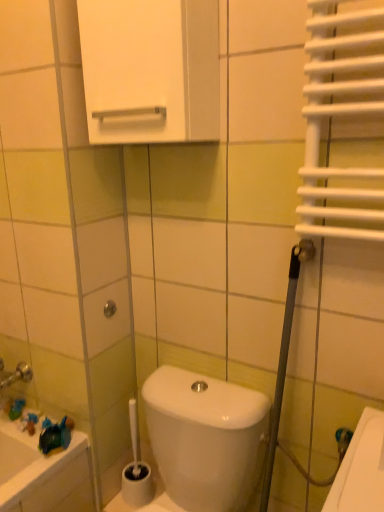
Question: Does white glossy cabinet at upper center have a larger size compared to metallic silver shower at center?

Choices:
 (A) no
 (B) yes

Answer: (B)

Question: From the image's perspective, is white glossy cabinet at upper center beneath metallic silver shower at center?

Choices:
 (A) no
 (B) yes

Answer: (A)

Question: From a real-world perspective, is white glossy cabinet at upper center over metallic silver shower at center?

Choices:
 (A) no
 (B) yes

Answer: (B)

Question: Can you confirm if white glossy cabinet at upper center is positioned to the left of metallic silver shower at center?

Choices:
 (A) no
 (B) yes

Answer: (A)

Question: Is white glossy cabinet at upper center outside of metallic silver shower at center?

Choices:
 (A) no
 (B) yes

Answer: (B)

Question: Is white glossy cabinet at upper center smaller than metallic silver shower at center?

Choices:
 (A) yes
 (B) no

Answer: (B)

Question: Could you tell me if white glossy cabinet at upper center is turned towards white plastic toilet brush at lower center?

Choices:
 (A) yes
 (B) no

Answer: (B)

Question: Is white glossy cabinet at upper center located outside white plastic toilet brush at lower center?

Choices:
 (A) no
 (B) yes

Answer: (B)

Question: Is white glossy cabinet at upper center far from white plastic toilet brush at lower center?

Choices:
 (A) yes
 (B) no

Answer: (A)

Question: Considering the relative positions of white glossy cabinet at upper center and white plastic toilet brush at lower center in the image provided, is white glossy cabinet at upper center to the right of white plastic toilet brush at lower center from the viewer's perspective?

Choices:
 (A) no
 (B) yes

Answer: (B)

Question: From the image's perspective, is white glossy cabinet at upper center above white plastic toilet brush at lower center?

Choices:
 (A) yes
 (B) no

Answer: (A)

Question: Considering the relative sizes of white glossy cabinet at upper center and white plastic toilet brush at lower center in the image provided, is white glossy cabinet at upper center thinner than white plastic toilet brush at lower center?

Choices:
 (A) yes
 (B) no

Answer: (B)

Question: Is white plastic toilet brush at lower center oriented away from metallic silver shower at center?

Choices:
 (A) yes
 (B) no

Answer: (B)